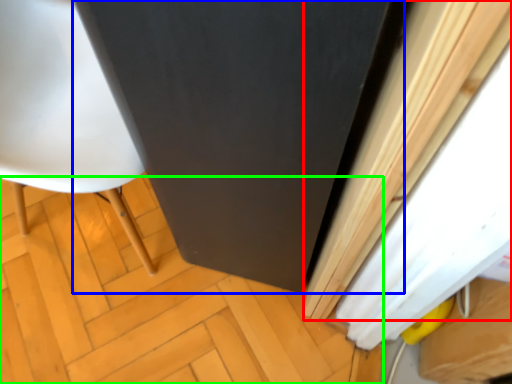
Question: Based on their relative distances, which object is nearer to curtain (highlighted by a red box)? Choose from screen door (highlighted by a blue box) and plywood (highlighted by a green box).

Choices:
 (A) screen door
 (B) plywood

Answer: (A)